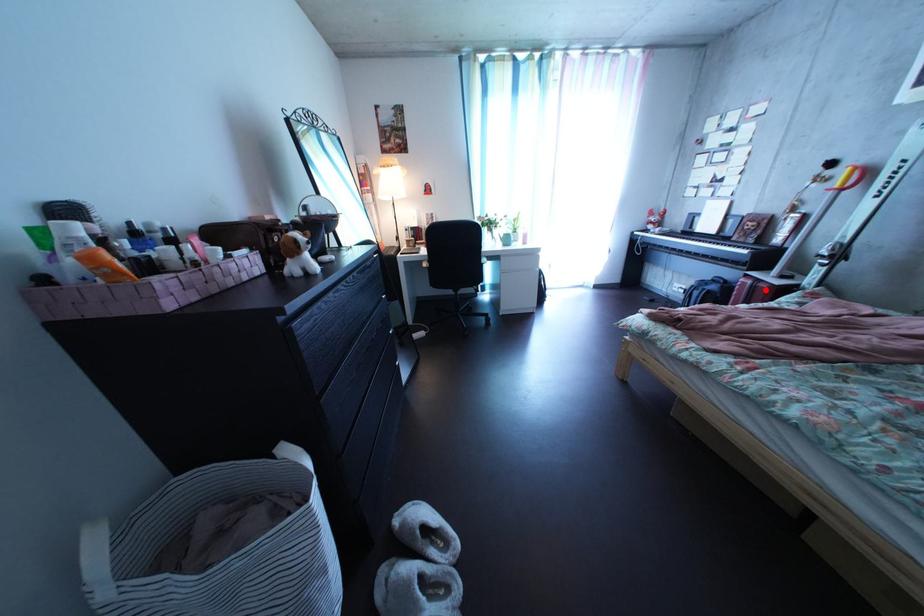
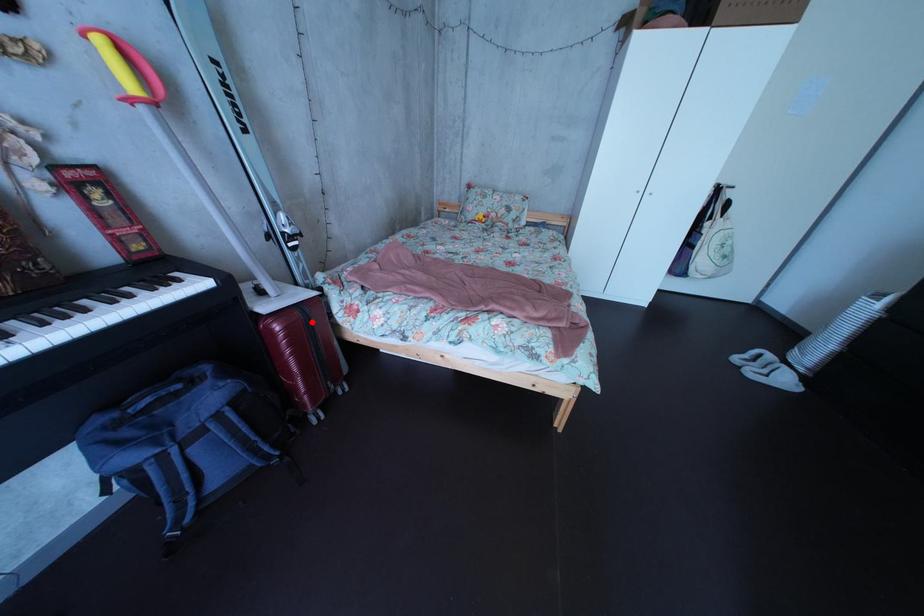
I am providing you with two images of the same scene from different viewpoints. A red point is marked on the first image and another point is marked on the second image. Do the highlighted points in image1 and image2 indicate the same real-world spot?

Yes